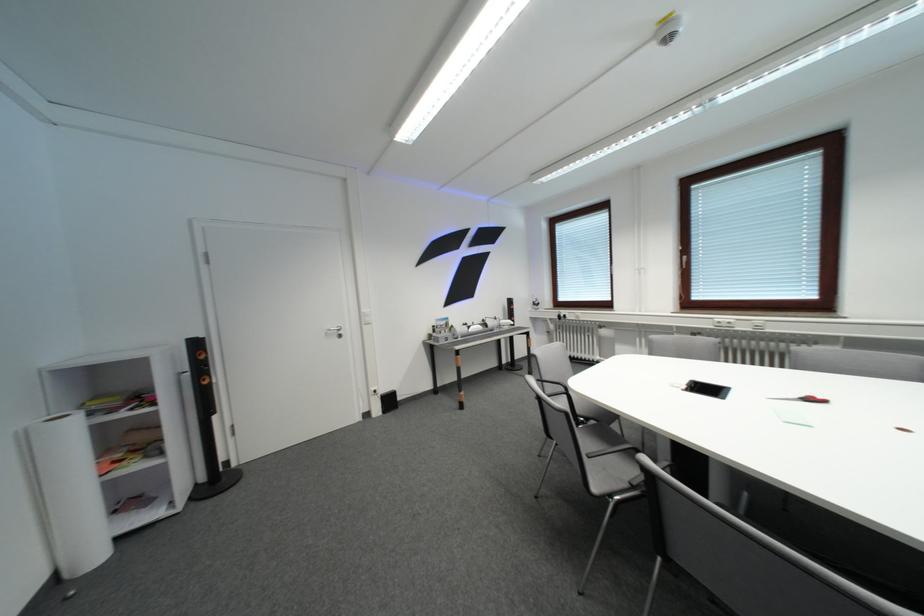
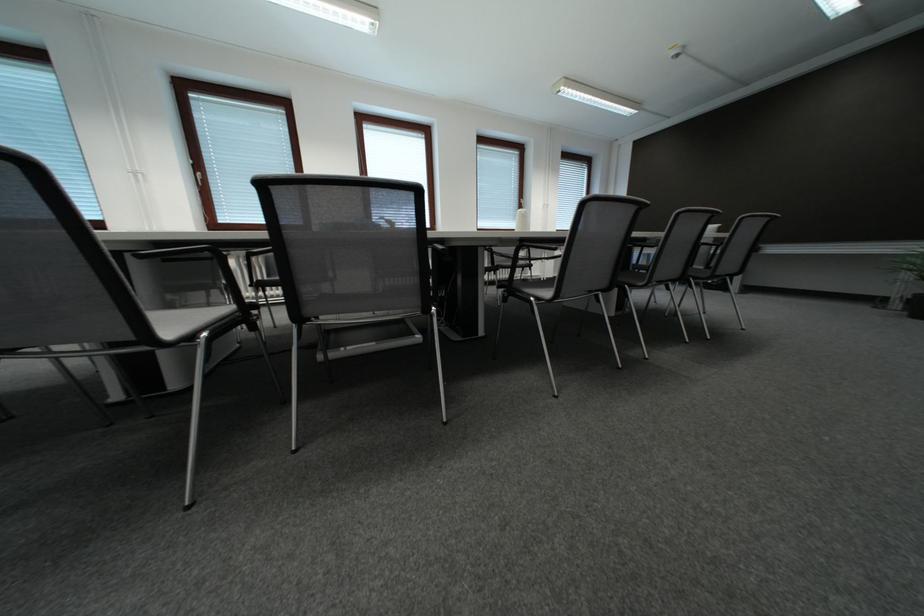
Question: Based on the continuous images, in which direction is the camera rotating? Reply with the corresponding letter.

Choices:
 (A) Left
 (B) Right
 (C) Up
 (D) Down

Answer: (B)